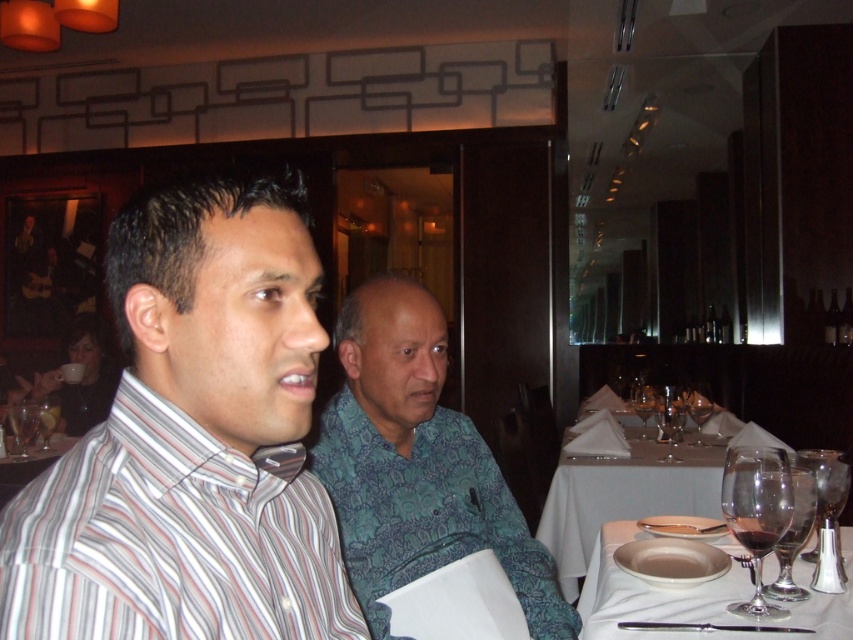
Question: Which point is closer to the camera?

Choices:
 (A) (357, 620)
 (B) (825, 486)
 (C) (24, 413)
 (D) (386, 285)

Answer: (A)

Question: Which point is closer to the camera taking this photo?

Choices:
 (A) (379, 620)
 (B) (20, 424)

Answer: (A)

Question: Is transparent glass wine glass at right thinner than transparent glass at left?

Choices:
 (A) yes
 (B) no

Answer: (A)

Question: Does white ceramic plate at lower right appear under clear glass wine glass at right?

Choices:
 (A) yes
 (B) no

Answer: (A)

Question: Does green patterned shirt at center lie in front of white ceramic plate at lower right?

Choices:
 (A) yes
 (B) no

Answer: (A)

Question: Among these objects, which one is nearest to the camera?

Choices:
 (A) clear glass wine glass at upper right
 (B) clear glass wine glass at left
 (C) white ceramic plate at lower right

Answer: (C)